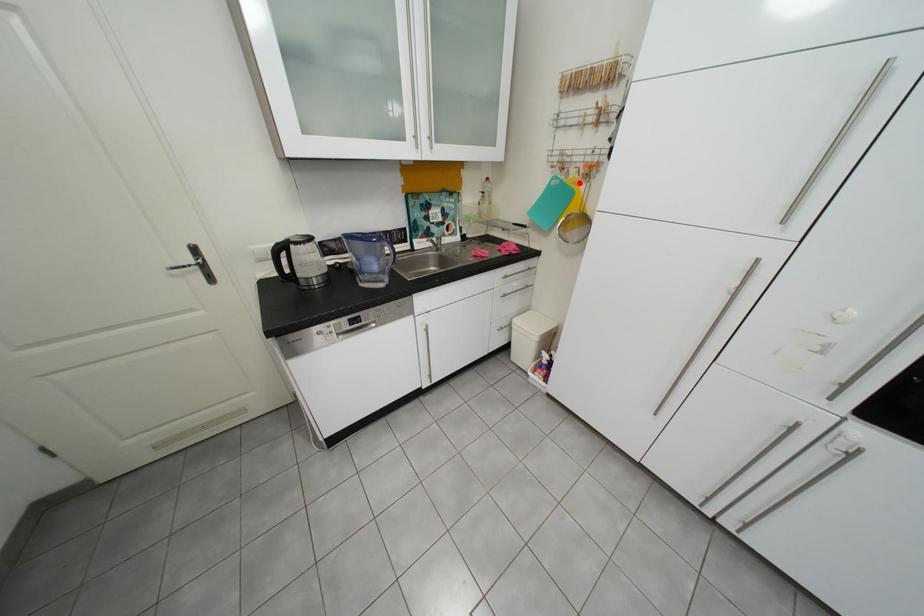
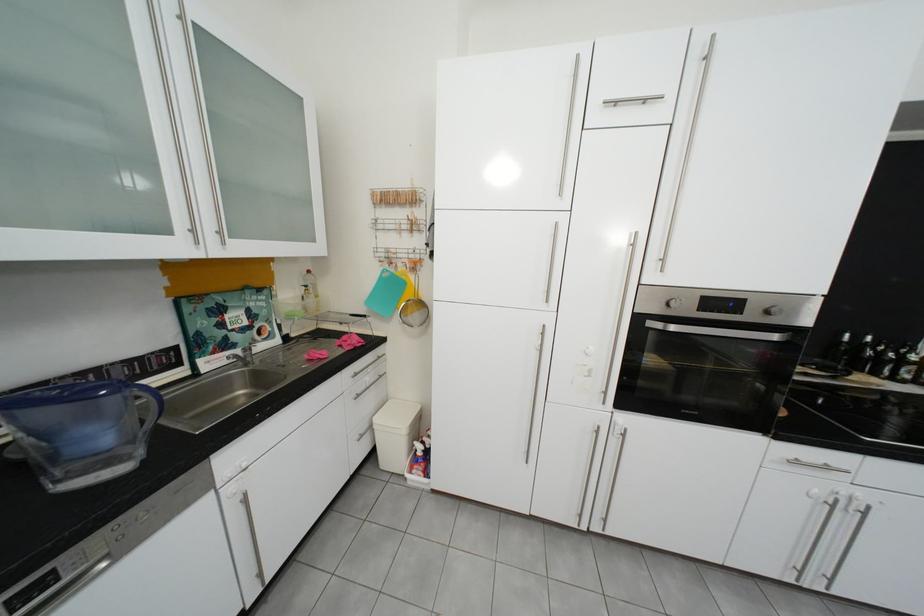
The point at the highlighted location is marked in the first image. Where is the corresponding point in the second image?

(409, 275)